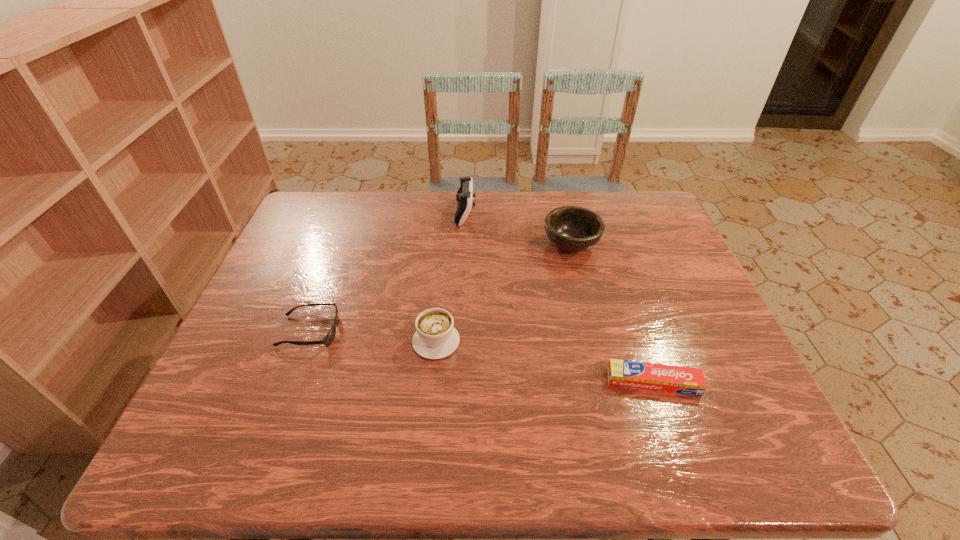
Locate an element on the screen. The height and width of the screenshot is (540, 960). free region located 0.190m on the front-facing side of the sunglasses is located at coordinates (420, 332).

Find the location of a particular element. The height and width of the screenshot is (540, 960). free spot located 0.050m on the back of the toothpaste is located at coordinates (642, 349).

Find the location of a particular element. control that is at the far edge is located at coordinates (464, 196).

Where is `bowl that is positioned at the far edge`? The width and height of the screenshot is (960, 540). bowl that is positioned at the far edge is located at coordinates (571, 228).

The height and width of the screenshot is (540, 960). Find the location of `object situated at the left edge`. object situated at the left edge is located at coordinates (328, 339).

This screenshot has width=960, height=540. In order to click on object present at the right edge in this screenshot , I will do `click(684, 380)`.

This screenshot has height=540, width=960. Identify the location of free space at the far edge of the desktop. point(392,206).

At what (x,y) coordinates should I click in order to perform the action: click on free space at the near edge of the desktop. Please return your answer as a coordinate pair (x, y). Looking at the image, I should click on (320, 461).

What are the coordinates of `vacant region at the right edge` in the screenshot? It's located at (676, 239).

Identify the location of vacant space at the far left corner of the desktop. This screenshot has width=960, height=540. (299, 229).